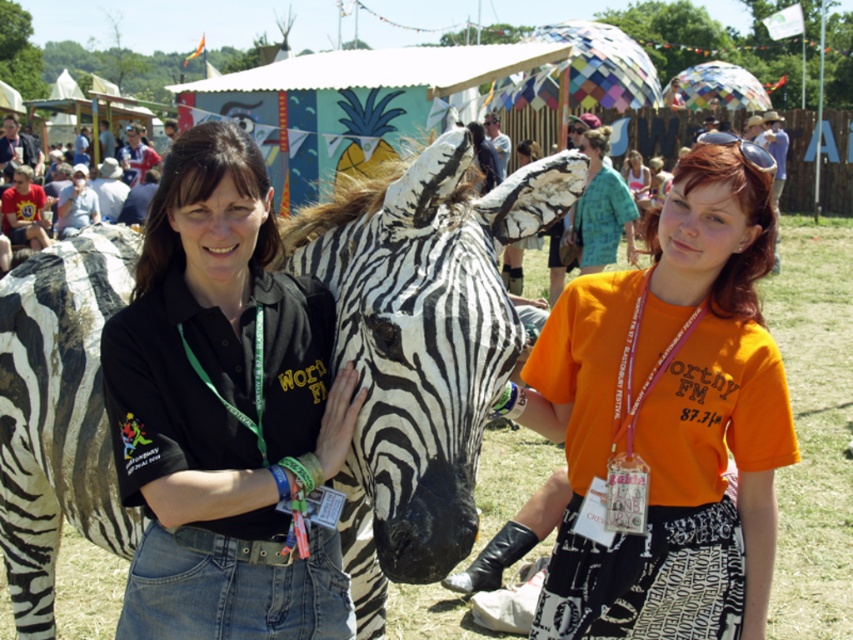
Does black matte shirt at center have a greater height compared to orange cotton t-shirt at center?

Incorrect, black matte shirt at center's height is not larger of orange cotton t-shirt at center's.

Looking at this image, is black matte shirt at center below orange cotton t-shirt at center?

Actually, black matte shirt at center is above orange cotton t-shirt at center.

Locate an element on the screen. This screenshot has height=640, width=853. black matte shirt at center is located at coordinates (224, 410).

At what (x,y) coordinates should I click in order to perform the action: click on black matte shirt at center. Please return your answer as a coordinate pair (x, y). Looking at the image, I should click on (224, 410).

Is point (392, 237) more distant than point (109, 420)?

Yes, point (392, 237) is farther from viewer.

Locate an element on the screen. This screenshot has height=640, width=853. black and white striped zebra at center is located at coordinates (422, 358).

Which is behind, point (375, 616) or point (738, 460)?

The point (375, 616) is behind.

Is black and white striped zebra at center positioned before orange cotton t-shirt at center?

Yes.

Is point (392, 362) more distant than point (724, 321)?

No, (392, 362) is closer to viewer.

Find the location of a particular element. Image resolution: width=853 pixels, height=640 pixels. black and white striped zebra at center is located at coordinates (422, 358).